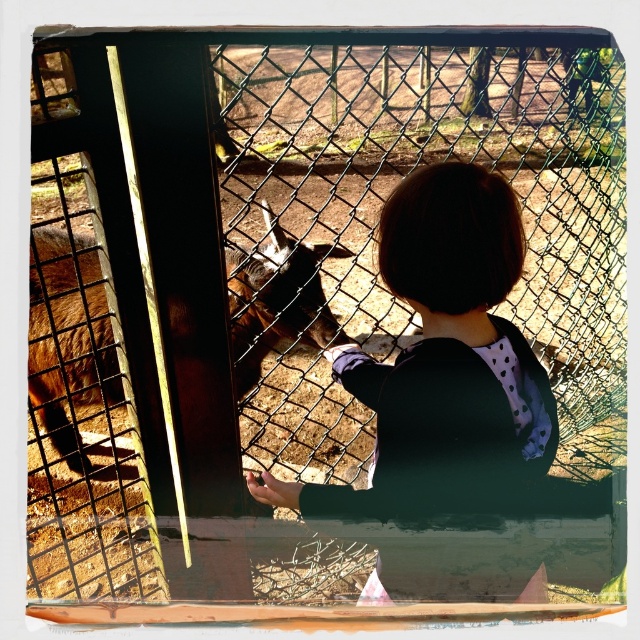
Is black matte shirt at center below brown furry goat at left?

Indeed, black matte shirt at center is positioned under brown furry goat at left.

Where is `black matte shirt at center`? The height and width of the screenshot is (640, 640). black matte shirt at center is located at coordinates (442, 356).

The height and width of the screenshot is (640, 640). I want to click on black matte shirt at center, so click(442, 356).